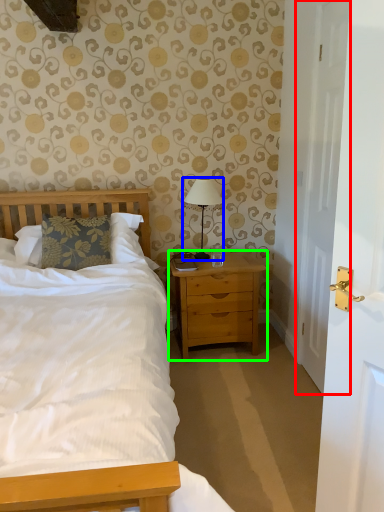
Question: Which is farther away from door (highlighted by a red box)? bedside lamp (highlighted by a blue box) or nightstand (highlighted by a green box)?

Choices:
 (A) bedside lamp
 (B) nightstand

Answer: (A)